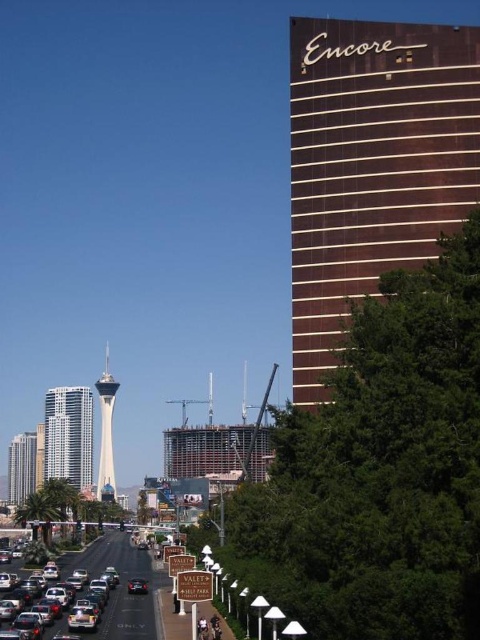
Is brown polished glass tower at upper right to the left of metallic silver car at lower left from the viewer's perspective?

Incorrect, brown polished glass tower at upper right is not on the left side of metallic silver car at lower left.

Identify the location of brown polished glass tower at upper right. (372, 164).

Is point (382, 38) closer to camera compared to point (92, 577)?

Yes, point (382, 38) is in front of point (92, 577).

What are the coordinates of `brown polished glass tower at upper right` in the screenshot? It's located at (372, 164).

I want to click on brown polished glass tower at upper right, so click(372, 164).

Does brown polished glass tower at upper right appear on the left side of white glass building at center?

In fact, brown polished glass tower at upper right is to the right of white glass building at center.

Measure the distance between point [300,305] and camera.

They are 328.94 feet apart.

Image resolution: width=480 pixels, height=640 pixels. Find the location of `brown polished glass tower at upper right`. brown polished glass tower at upper right is located at coordinates (372, 164).

Between white glass building at center and shiny silver skyscraper at left, which one appears on the right side from the viewer's perspective?

From the viewer's perspective, white glass building at center appears more on the right side.

Is white glass building at center to the left of shiny silver skyscraper at left from the viewer's perspective?

In fact, white glass building at center is to the right of shiny silver skyscraper at left.

Is point (48, 428) behind point (24, 460)?

That is False.

Identify the location of white glass building at center. (69, 435).